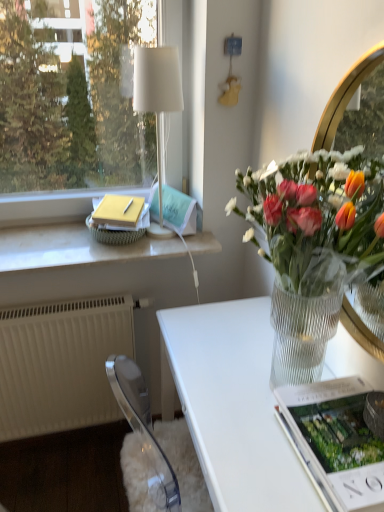
Where is `blank space above white glossy desk at center (from a real-world perspective)`? blank space above white glossy desk at center (from a real-world perspective) is located at coordinates (236, 364).